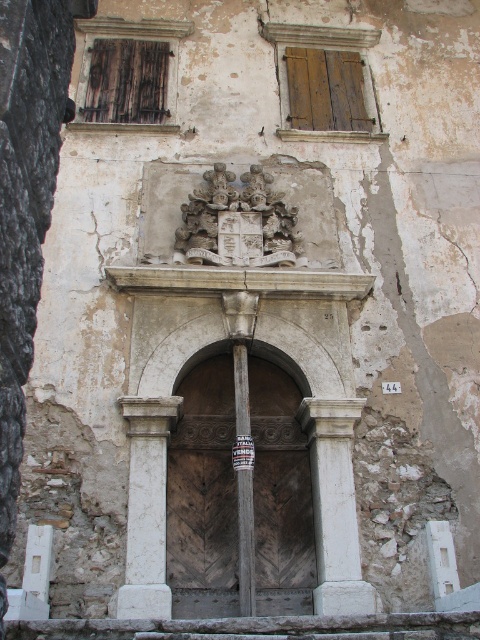
Question: Which point appears closest to the camera in this image?

Choices:
 (A) (252, 525)
 (B) (193, 588)
 (C) (216, 248)

Answer: (A)

Question: Which object is the closest to the wooden at center?

Choices:
 (A) white marble column at center
 (B) white stone coat of arms at center
 (C) wooden post at center

Answer: (C)

Question: Can you confirm if wooden at center is positioned below wooden post at center?

Choices:
 (A) yes
 (B) no

Answer: (A)

Question: Can you confirm if white stone coat of arms at center is positioned below white marble column at center?

Choices:
 (A) no
 (B) yes

Answer: (A)

Question: Is wooden at center wider than white stone coat of arms at center?

Choices:
 (A) no
 (B) yes

Answer: (A)

Question: Which of the following is the closest to the observer?

Choices:
 (A) wooden at center
 (B) wooden post at center
 (C) white stone coat of arms at center

Answer: (B)